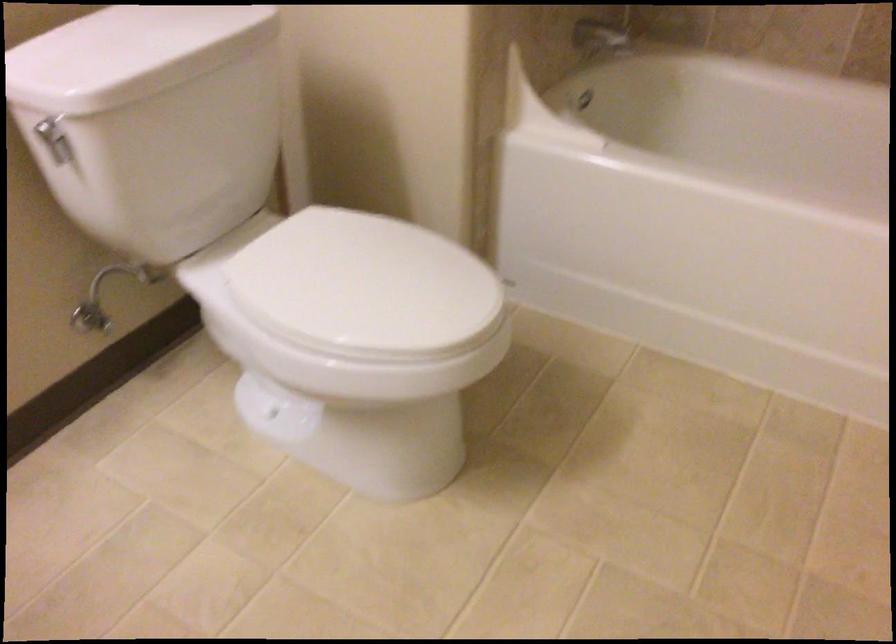
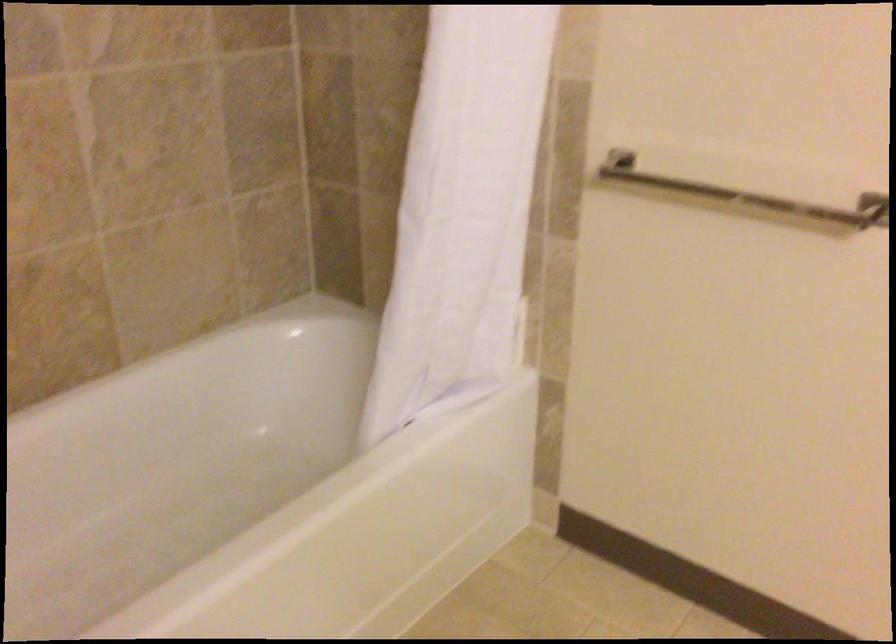
Based on the continuous images, in which direction is the camera rotating?

The rotation direction of the camera is right-down.